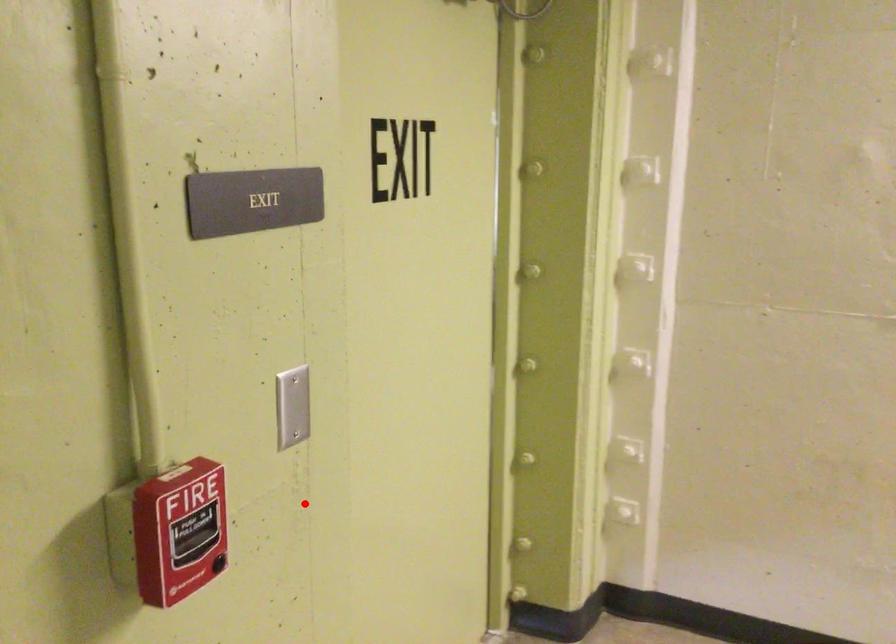
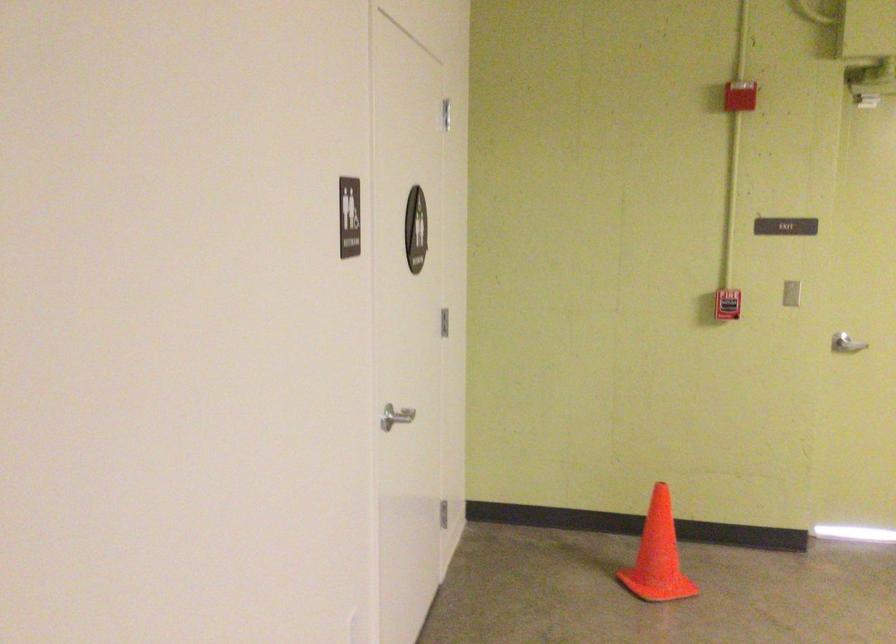
Question: A red point is marked in image1. In image2, is the corresponding 3D point closer to the camera or farther? Reply with the corresponding letter.

Choices:
 (A) The corresponding 3D point is closer.
 (B) The corresponding 3D point is farther.

Answer: (B)